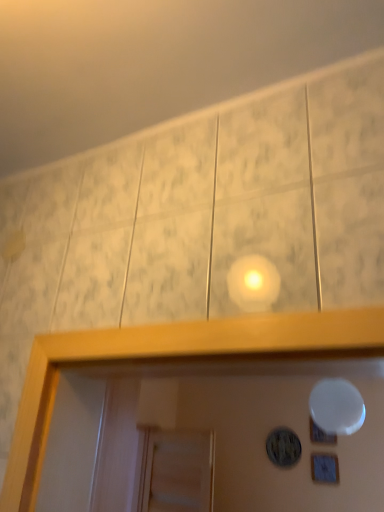
Question: Is white glossy plate at upper center, marked as the 2th dot in a left-to-right arrangement, in front of or behind white glossy mirror at upper center in the image?

Choices:
 (A) behind
 (B) front

Answer: (A)

Question: From the image's perspective, is white glossy plate at upper center, marked as the 2th dot in a left-to-right arrangement, above or below white glossy mirror at upper center?

Choices:
 (A) above
 (B) below

Answer: (B)

Question: Which is nearer to the white glossy plate at upper center, the first dot positioned from the right?

Choices:
 (A) matte black circular object at center, marked as the 2th dot in a right-to-left arrangement
 (B) white glossy mirror at upper center
 (C) wooden frame at lower right

Answer: (C)

Question: Which object is positioned farthest from the white glossy mirror at upper center?

Choices:
 (A) wooden frame at lower right
 (B) white glossy plate at upper center, the first dot positioned from the right
 (C) matte black circular object at center, which is the first dot in left-to-right order

Answer: (C)